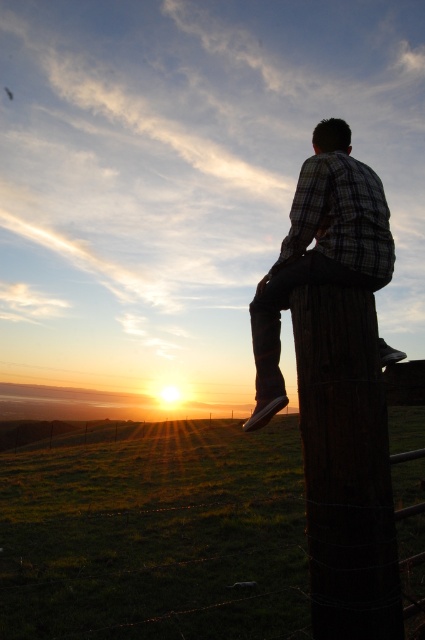
In the scene shown: Is wooden post at center to the right of plaid shirt at center from the viewer's perspective?

In fact, wooden post at center is to the left of plaid shirt at center.

Which is more to the right, wooden post at center or plaid shirt at center?

plaid shirt at center

Who is more distant from viewer, (79, 515) or (266, 392)?

Point (79, 515)

Where is `wooden post at center`? This screenshot has height=640, width=425. wooden post at center is located at coordinates (155, 541).

Does dark brown wooden post at right appear on the left side of plaid shirt at center?

Yes, dark brown wooden post at right is to the left of plaid shirt at center.

Who is more forward, (363, 433) or (329, 260)?

Point (363, 433) is more forward.

You are a GUI agent. You are given a task and a screenshot of the screen. Output one action in this format:
    pyautogui.click(x=<x>, y=<y>)
    Task: Click on the dark brown wooden post at right
    The height and width of the screenshot is (640, 425).
    Given the screenshot: What is the action you would take?
    pyautogui.click(x=345, y=465)

Between wooden post at center and dark brown wooden post at right, which one has less height?

dark brown wooden post at right is shorter.

Is wooden post at center closer to the viewer compared to dark brown wooden post at right?

No.

Who is more forward, (x=37, y=513) or (x=387, y=548)?

Point (x=387, y=548)

At what (x,y) coordinates should I click in order to perform the action: click on wooden post at center. Please return your answer as a coordinate pair (x, y). The height and width of the screenshot is (640, 425). Looking at the image, I should click on (155, 541).